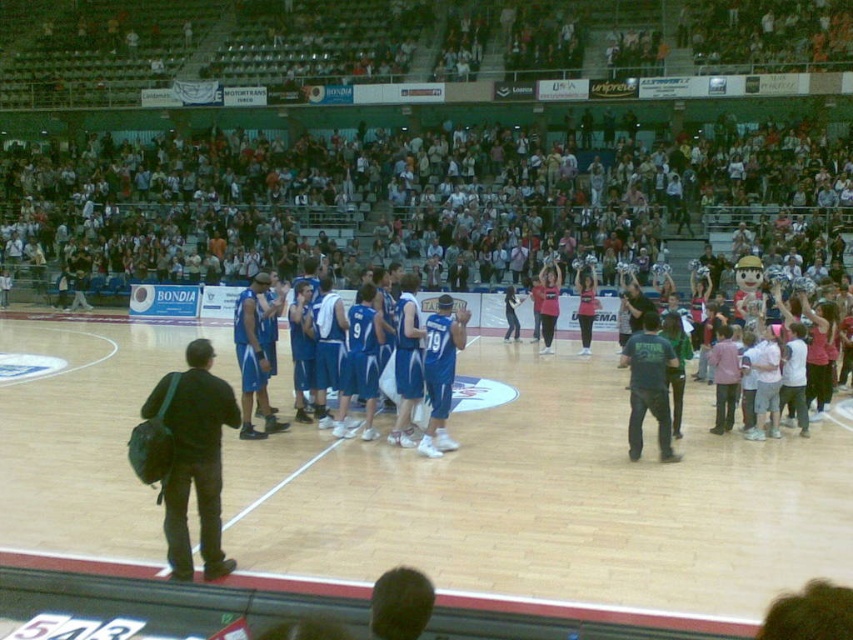
In the scene shown: You are a photographer at the basketball game and want to capture a photo of the pink jersey at center without the pink fabric cheerleader at center blocking it. Is this possible based on their positions?

The pink fabric cheerleader at center is positioned over the pink jersey at center, so it will block the view. To capture the pink jersey at center without obstruction, you would need to adjust your angle or wait until their positions change.

You are a photographer at the basketball game. You want to take a photo of the pink jersey at center without the pink fabric cheerleader at center blocking it. How should you adjust your position?

The pink jersey at center is behind the pink fabric cheerleader at center, so you should move behind the pink fabric cheerleader at center to capture the pink jersey at center without obstruction.

You are a photographer standing at the edge of the court. You want to capture a photo that includes both the wooden floor at center and the pink fabric cheerleader at center. Which object should you focus on first if you want to ensure both are in frame?

The wooden floor at center is bigger than the pink fabric cheerleader at center, so you should focus on the wooden floor at center first to ensure it fits properly in the frame before adjusting for the smaller cheerleader.